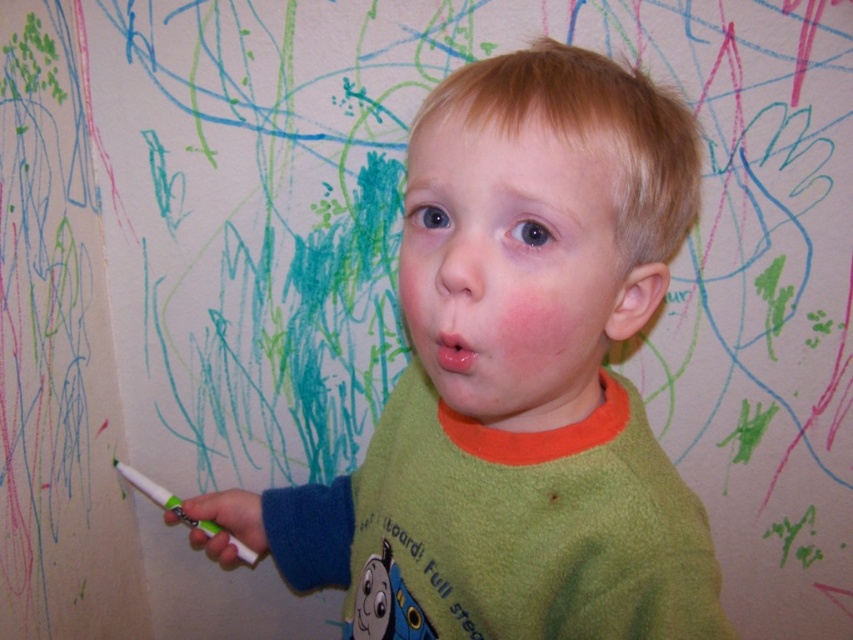
Looking at this image, which is more to the right, green fleece shirt at center or white plastic crayon at lower left?

From the viewer's perspective, green fleece shirt at center appears more on the right side.

Can you confirm if green fleece shirt at center is smaller than white plastic crayon at lower left?

No.

Is point (448, 157) less distant than point (244, 548)?

Yes, point (448, 157) is closer to viewer.

You are a GUI agent. You are given a task and a screenshot of the screen. Output one action in this format:
    pyautogui.click(x=<x>, y=<y>)
    Task: Click on the green fleece shirt at center
    The width and height of the screenshot is (853, 640).
    Given the screenshot: What is the action you would take?
    pyautogui.click(x=515, y=380)